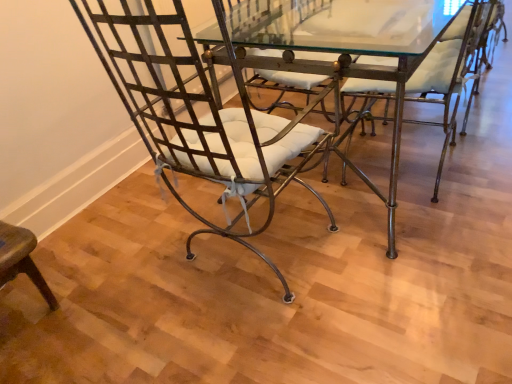
Question: In the image, is metallic wrought iron chair at center, the 1th chair when ordered from right to left, on the left side or the right side of metallic/glass table at center?

Choices:
 (A) left
 (B) right

Answer: (B)

Question: Is metallic wrought iron chair at center, the 1th chair when ordered from right to left, in front of or behind metallic/glass table at center in the image?

Choices:
 (A) behind
 (B) front

Answer: (A)

Question: Estimate the real-world distances between objects in this image. Which object is farther from the metallic wire chair at left, the 1th chair viewed from the left?

Choices:
 (A) metallic/glass table at center
 (B) metallic wrought iron chair at center, the 1th chair when ordered from right to left

Answer: (A)

Question: Which object is the farthest from the metallic/glass table at center?

Choices:
 (A) metallic wire chair at left, the 1th chair viewed from the left
 (B) metallic wrought iron chair at center, which is the 2th chair from left to right

Answer: (A)